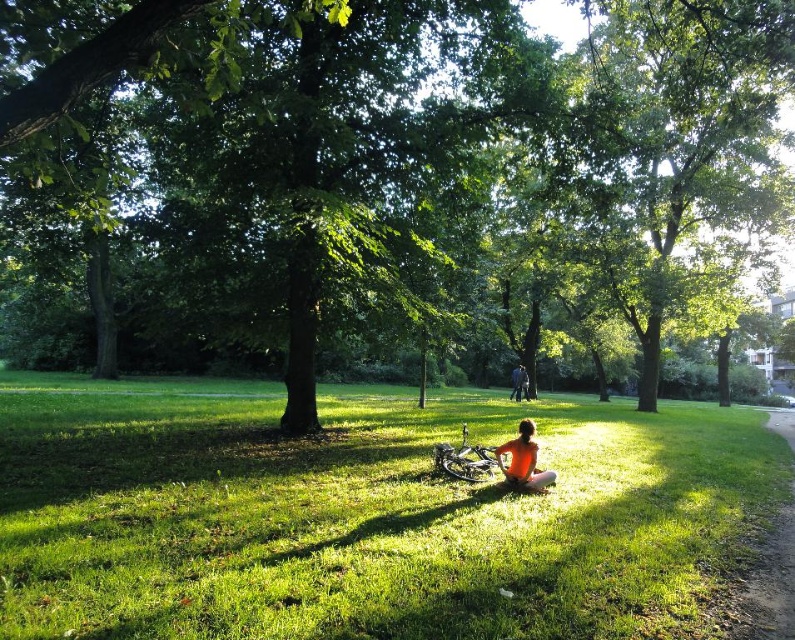
In the scene shown: You are a photographer planning to take a portrait of the orange fabric person at center and dark blue jeans at center. Since you want to ensure both subjects are in focus, you need to know which one is narrower. Which one is narrower?

The orange fabric person at center is narrower than the dark blue jeans at center, so you should adjust your camera settings to focus on the narrower subject first.

You are standing at the point marked by the coordinates point (365, 515) in the park scene. What is the immediate surface you are standing on?

The point (365, 515) marks green grassy at center, so you are standing on green grassy at center.

You are planning to set up a small picnic blanket between the green leafy tree at center and the orange fabric person at center. Which object should you place the blanket closer to to ensure it doesn not get in the way of the tree or the person?

The green leafy tree at center is wider than the orange fabric person at center, so you should place the picnic blanket closer to the orange fabric person at center to avoid the wider tree.